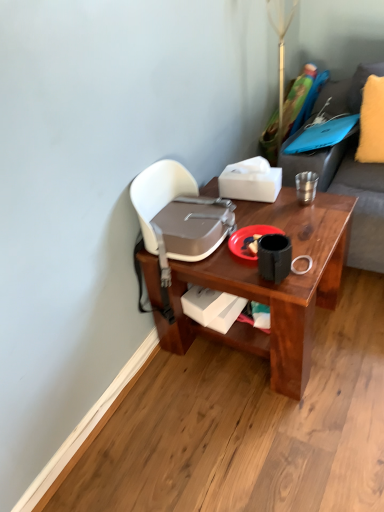
You are a GUI agent. You are given a task and a screenshot of the screen. Output one action in this format:
    pyautogui.click(x=<x>, y=<y>)
    Task: Click on the free space in front of white matte tissue box at upper center, which ranks as the 2th box in bottom-to-top order
    This screenshot has width=384, height=512.
    Given the screenshot: What is the action you would take?
    pyautogui.click(x=266, y=213)